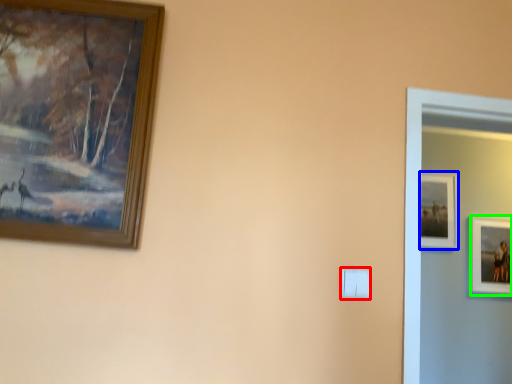
Question: Considering the real-world distances, which object is farthest from light switch (highlighted by a red box)? picture frame (highlighted by a blue box) or picture frame (highlighted by a green box)?

Choices:
 (A) picture frame
 (B) picture frame

Answer: (B)